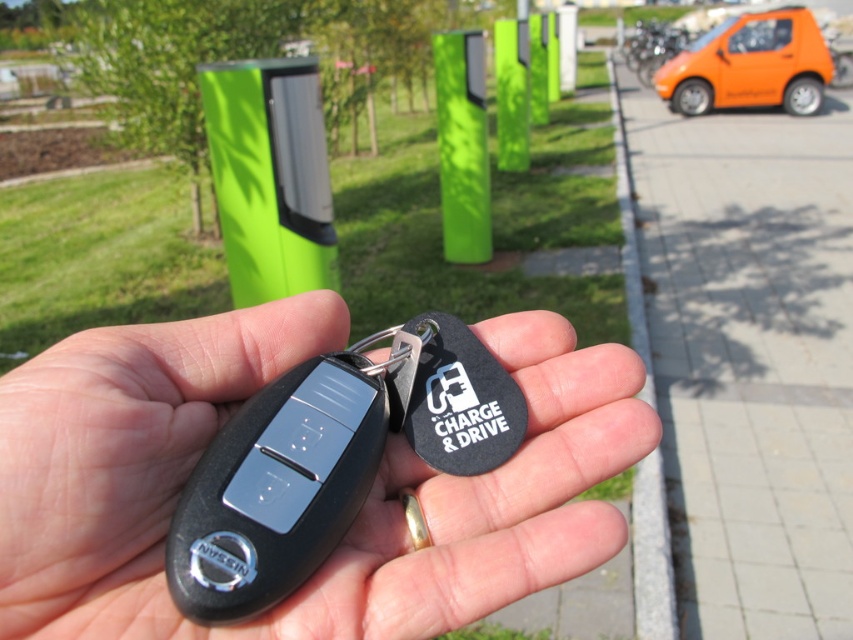
Identify the location of orange matte car at right. (750, 65).

Who is shorter, orange matte car at right or green matte pole at center?

green matte pole at center is shorter.

Locate an element on the screen. Image resolution: width=853 pixels, height=640 pixels. orange matte car at right is located at coordinates (750, 65).

Between point (172, 637) and point (704, 61), which one is positioned behind?

Point (704, 61)

This screenshot has height=640, width=853. What do you see at coordinates (358, 513) in the screenshot? I see `black matte key fob at center` at bounding box center [358, 513].

I want to click on black matte key fob at center, so click(x=358, y=513).

Who is more distant from viewer, (502, 592) or (486, 157)?

The point (486, 157) is more distant.

The width and height of the screenshot is (853, 640). In order to click on black matte key fob at center in this screenshot , I will do `click(358, 513)`.

Is point (82, 563) farther from camera compared to point (456, 196)?

No, it is not.

Where is `black matte key fob at center`? The width and height of the screenshot is (853, 640). black matte key fob at center is located at coordinates (358, 513).